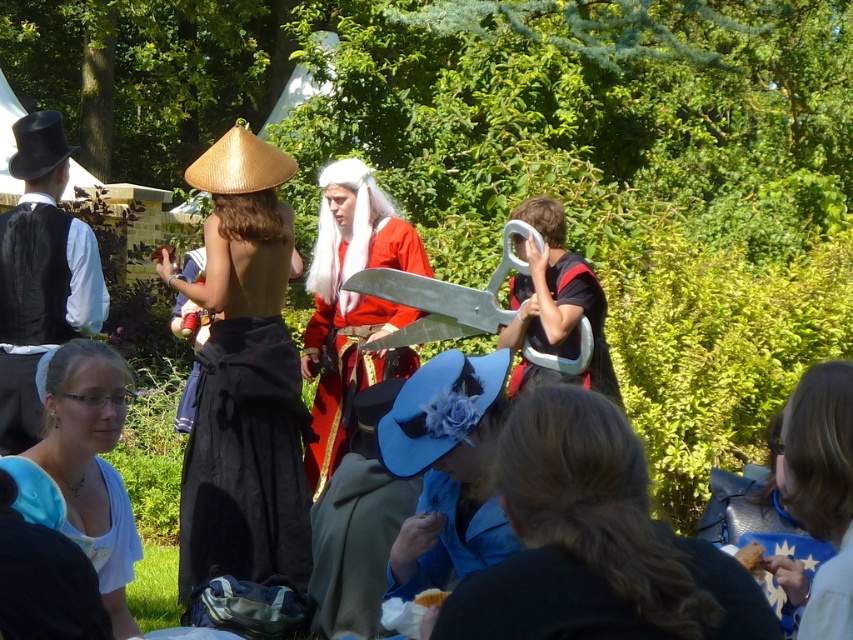
Between blue fabric hat at lower center and blue fabric robe at lower center, which one has more height?

blue fabric hat at lower center

Does blue fabric hat at lower center come behind blue fabric robe at lower center?

No, blue fabric hat at lower center is in front of blue fabric robe at lower center.

Is point (498, 442) positioned behind point (563, 579)?

Yes, point (498, 442) is behind point (563, 579).

Find the location of a particular element. The height and width of the screenshot is (640, 853). blue fabric hat at lower center is located at coordinates (593, 541).

Can you confirm if black velvet vest at left is positioned above blue fabric shirt at lower left?

Indeed, black velvet vest at left is positioned over blue fabric shirt at lower left.

Does black velvet vest at left have a larger size compared to blue fabric shirt at lower left?

Yes.

At what (x,y) coordinates should I click in order to perform the action: click on black velvet vest at left. Please return your answer as a coordinate pair (x, y). Looking at the image, I should click on (41, 275).

Is black velvet vest at left positioned at the back of blue fabric robe at lower center?

Yes, black velvet vest at left is behind blue fabric robe at lower center.

Measure the distance between black velvet vest at left and blue fabric robe at lower center.

black velvet vest at left is 5.09 meters from blue fabric robe at lower center.

Who is more forward, (x=45, y=328) or (x=480, y=628)?

Positioned in front is point (x=480, y=628).

Find the location of a particular element. The height and width of the screenshot is (640, 853). black velvet vest at left is located at coordinates (41, 275).